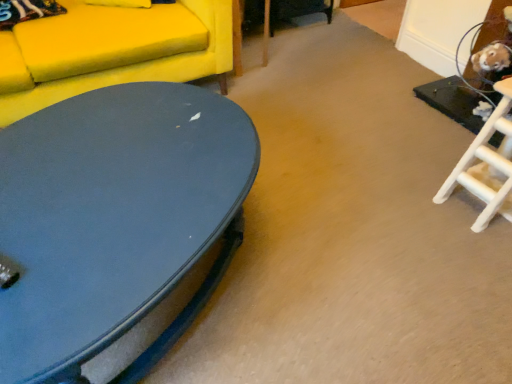
Where is `empty space that is to the right of matte blue coffee table at lower left`? The image size is (512, 384). empty space that is to the right of matte blue coffee table at lower left is located at coordinates (350, 254).